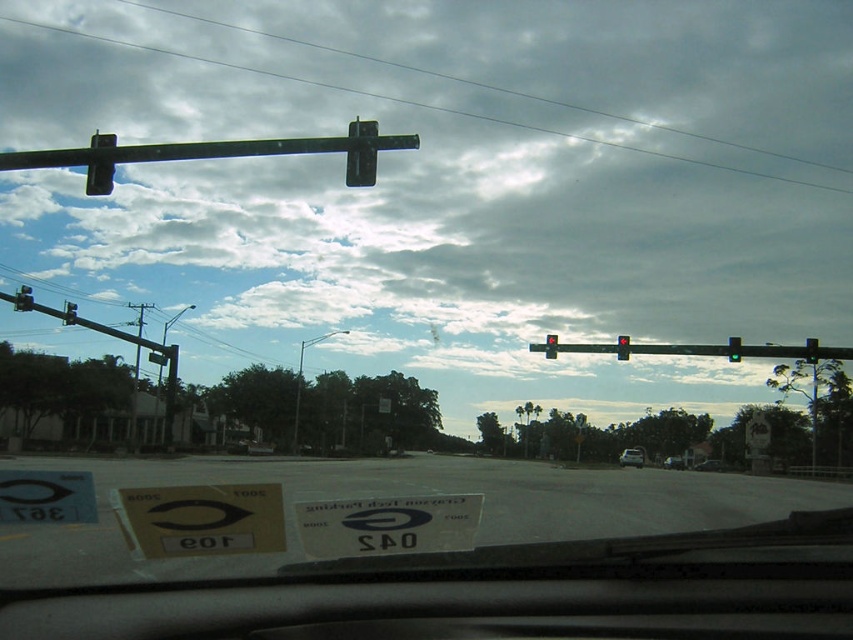
The height and width of the screenshot is (640, 853). Find the location of `white matte car at center`. white matte car at center is located at coordinates (631, 458).

Which is above, white matte car at center or red glass traffic light at upper right?

Positioned higher is red glass traffic light at upper right.

At what (x,y) coordinates should I click in order to perform the action: click on white matte car at center. Please return your answer as a coordinate pair (x, y). Image resolution: width=853 pixels, height=640 pixels. Looking at the image, I should click on (631, 458).

Identify the location of white matte car at center. The height and width of the screenshot is (640, 853). (631, 458).

Is yellow cardboard sign at center shorter than metallic traffic light at upper left?

Incorrect, yellow cardboard sign at center's height does not fall short of metallic traffic light at upper left's.

Which is more to the left, yellow cardboard sign at center or metallic traffic light at upper left?

From the viewer's perspective, metallic traffic light at upper left appears more on the left side.

Identify the location of yellow cardboard sign at center. (200, 518).

Locate an element on the screen. This screenshot has height=640, width=853. yellow cardboard sign at center is located at coordinates (200, 518).

Does point (370, 145) come closer to viewer compared to point (111, 180)?

Yes, it is in front of point (111, 180).

This screenshot has height=640, width=853. What are the coordinates of `black plastic traffic light at upper center` in the screenshot? It's located at (361, 154).